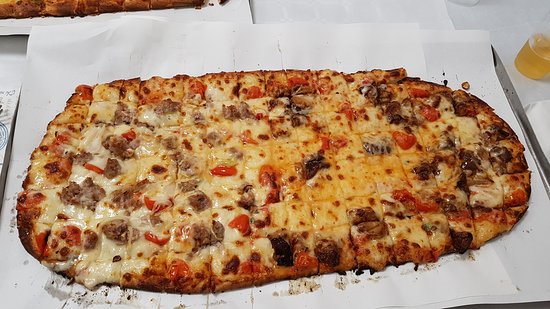
Where is `sheet pan`? sheet pan is located at coordinates (544, 180), (4, 172).